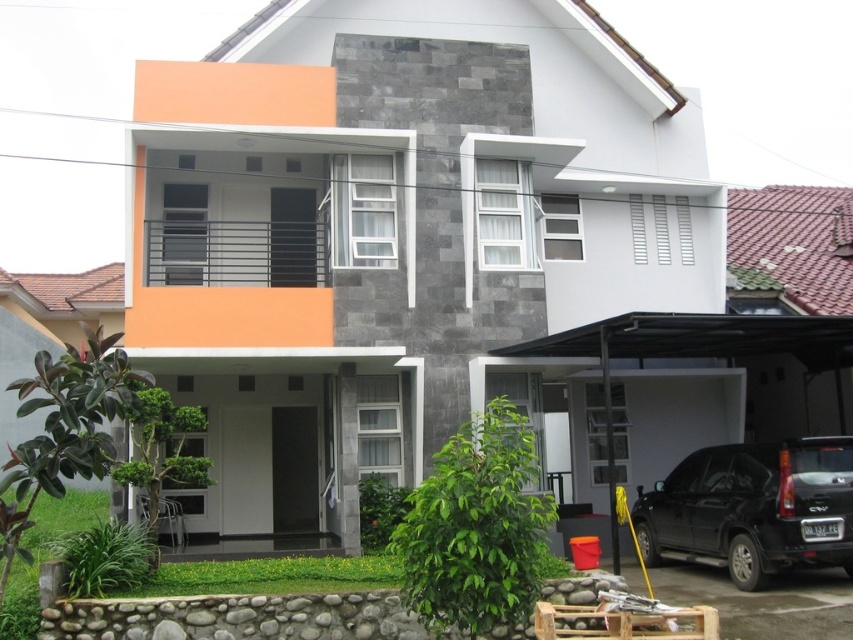
You are standing in front of the modern two story residential building and see two points marked on the facade. The first point is at coordinates point (457, 4) and the second point is at point (776, 520). Which point is closer to you?

Point (457, 4) is further to the camera than point (776, 520), so the point closer to you is point (776, 520).

You are a delivery person standing at the entrance of the residential building. You need to locate the white concrete garage at lower right. Based on the coordinates provided, can you determine its location relative to the entrance?

The white concrete garage at lower right is located at coordinates point [395,228], which is to the right and slightly below the entrance area.